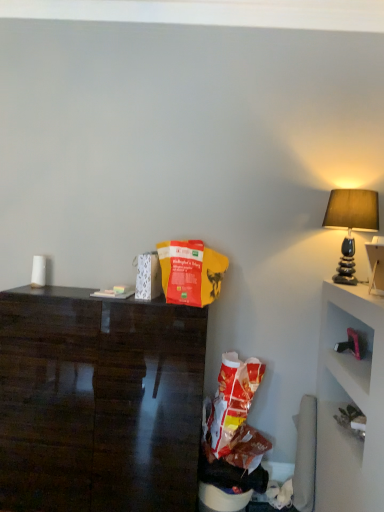
Question: Is matte stone lamp at right further to the viewer compared to red matte paper bag at center?

Choices:
 (A) yes
 (B) no

Answer: (A)

Question: Does matte stone lamp at right have a lesser height compared to red matte paper bag at center?

Choices:
 (A) yes
 (B) no

Answer: (B)

Question: Does matte stone lamp at right have a greater width compared to red matte paper bag at center?

Choices:
 (A) no
 (B) yes

Answer: (B)

Question: From the image's perspective, is matte stone lamp at right below red matte paper bag at center?

Choices:
 (A) no
 (B) yes

Answer: (A)

Question: Is matte stone lamp at right not close to red matte paper bag at center?

Choices:
 (A) no
 (B) yes

Answer: (A)

Question: Is matte stone lamp at right not within red matte paper bag at center?

Choices:
 (A) no
 (B) yes

Answer: (B)

Question: Is the surface of dark wood desk at left in direct contact with matte stone lamp at right?

Choices:
 (A) no
 (B) yes

Answer: (A)

Question: Does dark wood desk at left have a smaller size compared to matte stone lamp at right?

Choices:
 (A) no
 (B) yes

Answer: (A)

Question: Can you confirm if dark wood desk at left is bigger than matte stone lamp at right?

Choices:
 (A) yes
 (B) no

Answer: (A)

Question: Are dark wood desk at left and matte stone lamp at right located far from each other?

Choices:
 (A) no
 (B) yes

Answer: (B)

Question: Can you confirm if dark wood desk at left is taller than matte stone lamp at right?

Choices:
 (A) no
 (B) yes

Answer: (B)

Question: Can you confirm if dark wood desk at left is positioned to the right of matte stone lamp at right?

Choices:
 (A) yes
 (B) no

Answer: (B)

Question: Is matte stone lamp at right positioned with its back to dark wood desk at left?

Choices:
 (A) no
 (B) yes

Answer: (A)